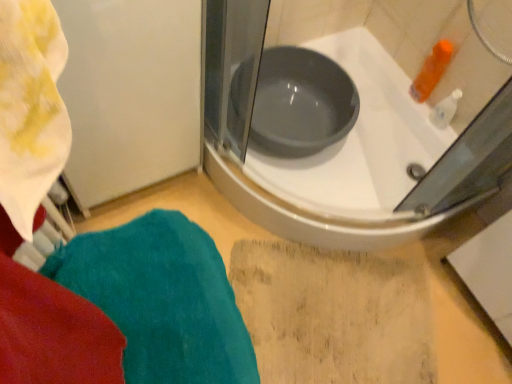
You are a GUI agent. You are given a task and a screenshot of the screen. Output one action in this format:
    pyautogui.click(x=<x>, y=<y>)
    Task: Click on the matte gray basin at center
    
    Given the screenshot: What is the action you would take?
    pyautogui.click(x=301, y=103)

Where is `white glossy bathtub at upper center`? This screenshot has height=384, width=512. white glossy bathtub at upper center is located at coordinates (377, 168).

Locate an element on the screen. matte gray basin at center is located at coordinates (301, 103).

Relative to teal plush towel at lower left, is white glossy bathtub at upper center in front or behind?

white glossy bathtub at upper center is positioned farther from the viewer than teal plush towel at lower left.

Is white glossy bathtub at upper center far away from teal plush towel at lower left?

No, white glossy bathtub at upper center is not far from teal plush towel at lower left.

Which of these two, white glossy bathtub at upper center or teal plush towel at lower left, is thinner?

teal plush towel at lower left.

From the image's perspective, which one is positioned higher, white glossy bathtub at upper center or teal plush towel at lower left?

white glossy bathtub at upper center.

Is teal plush towel at lower left next to white glossy bathtub at upper center?

teal plush towel at lower left is not next to white glossy bathtub at upper center, and they're not touching.

Considering their positions, is teal plush towel at lower left located in front of or behind white glossy bathtub at upper center?

In the image, teal plush towel at lower left appears in front of white glossy bathtub at upper center.

Between teal plush towel at lower left and white glossy bathtub at upper center, which one has smaller size?

With smaller size is teal plush towel at lower left.

Choose the correct answer: Is teal plush towel at lower left inside white glossy bathtub at upper center or outside it?

The correct answer is: outside.

Is matte gray basin at center inside white glossy bathtub at upper center?

That's correct, matte gray basin at center is inside white glossy bathtub at upper center.

Does white glossy bathtub at upper center appear on the left side of matte gray basin at center?

No.

In terms of size, does white glossy bathtub at upper center appear bigger or smaller than matte gray basin at center?

Clearly, white glossy bathtub at upper center is larger in size than matte gray basin at center.

From a real-world perspective, is white glossy bathtub at upper center physically below matte gray basin at center?

Yes, from a real-world perspective, white glossy bathtub at upper center is beneath matte gray basin at center.

From a real-world perspective, is matte gray basin at center physically located above or below white glossy bathtub at upper center?

Clearly, from a real-world perspective, matte gray basin at center is above white glossy bathtub at upper center.

In the scene shown: Is matte gray basin at center far from white glossy bathtub at upper center?

No, matte gray basin at center is not far from white glossy bathtub at upper center.

Can you tell me how much matte gray basin at center and white glossy bathtub at upper center differ in facing direction?

matte gray basin at center and white glossy bathtub at upper center are facing 2.11 degrees away from each other.

Does point (151, 312) come behind point (268, 110)?

No.

Consider the image. From a real-world perspective, which is physically below, teal plush towel at lower left or matte gray basin at center?

matte gray basin at center.

From the image's perspective, would you say teal plush towel at lower left is positioned over matte gray basin at center?

No, from the image's perspective, teal plush towel at lower left is not above matte gray basin at center.

Measure the distance from teal plush towel at lower left to matte gray basin at center.

teal plush towel at lower left and matte gray basin at center are 25.52 inches apart.

Is matte gray basin at center taller or shorter than teal plush towel at lower left?

Clearly, matte gray basin at center is shorter compared to teal plush towel at lower left.

Is point (297, 148) positioned in front of point (210, 343)?

No, (297, 148) is further to viewer.

The width and height of the screenshot is (512, 384). What are the coordinates of `bath towel in front of the matte gray basin at center` in the screenshot? It's located at (162, 299).

Does matte gray basin at center touch teal plush towel at lower left?

There is a gap between matte gray basin at center and teal plush towel at lower left.

At what (x,y) coordinates should I click in order to perform the action: click on bath towel above the white glossy bathtub at upper center (from a real-world perspective). Please return your answer as a coordinate pair (x, y). This screenshot has height=384, width=512. Looking at the image, I should click on (162, 299).

You are a GUI agent. You are given a task and a screenshot of the screen. Output one action in this format:
    pyautogui.click(x=<x>, y=<y>)
    Task: Click on the bath towel below the white glossy bathtub at upper center (from the image's perspective)
    The width and height of the screenshot is (512, 384).
    Given the screenshot: What is the action you would take?
    pyautogui.click(x=162, y=299)

Estimate the real-world distances between objects in this image. Which object is further from matte gray basin at center, white glossy bathtub at upper center or teal plush towel at lower left?

teal plush towel at lower left is further to matte gray basin at center.

Based on their spatial positions, is teal plush towel at lower left or matte gray basin at center further from white glossy bathtub at upper center?

Among the two, teal plush towel at lower left is located further to white glossy bathtub at upper center.

Based on their spatial positions, is white glossy bathtub at upper center or matte gray basin at center closer to teal plush towel at lower left?

matte gray basin at center is positioned closer to the anchor teal plush towel at lower left.

From the image, which object appears to be farther from teal plush towel at lower left, matte gray basin at center or white glossy bathtub at upper center?

Among the two, white glossy bathtub at upper center is located further to teal plush towel at lower left.

When comparing their distances from white glossy bathtub at upper center, does matte gray basin at center or teal plush towel at lower left seem further?

Based on the image, teal plush towel at lower left appears to be further to white glossy bathtub at upper center.

Based on their spatial positions, is teal plush towel at lower left or white glossy bathtub at upper center closer to matte gray basin at center?

white glossy bathtub at upper center.

This screenshot has height=384, width=512. What are the coordinates of `bathtub between teal plush towel at lower left and matte gray basin at center from front to back` in the screenshot? It's located at (377, 168).